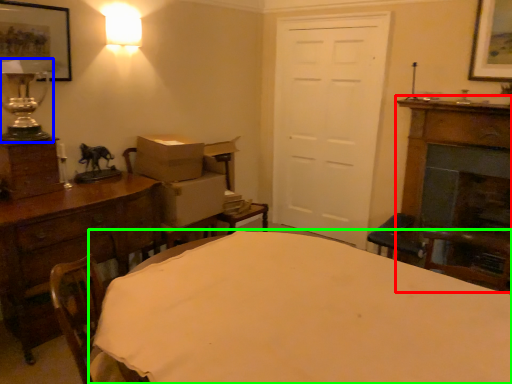
Question: Based on their relative distances, which object is nearer to fireplace (highlighted by a red box)? Choose from table lamp (highlighted by a blue box) and table (highlighted by a green box).

Choices:
 (A) table lamp
 (B) table

Answer: (B)